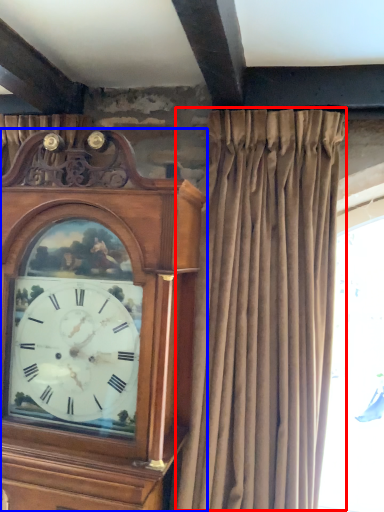
Question: Which point is further to the camera, curtain (highlighted by a red box) or clock (highlighted by a blue box)?

Choices:
 (A) curtain
 (B) clock

Answer: (B)